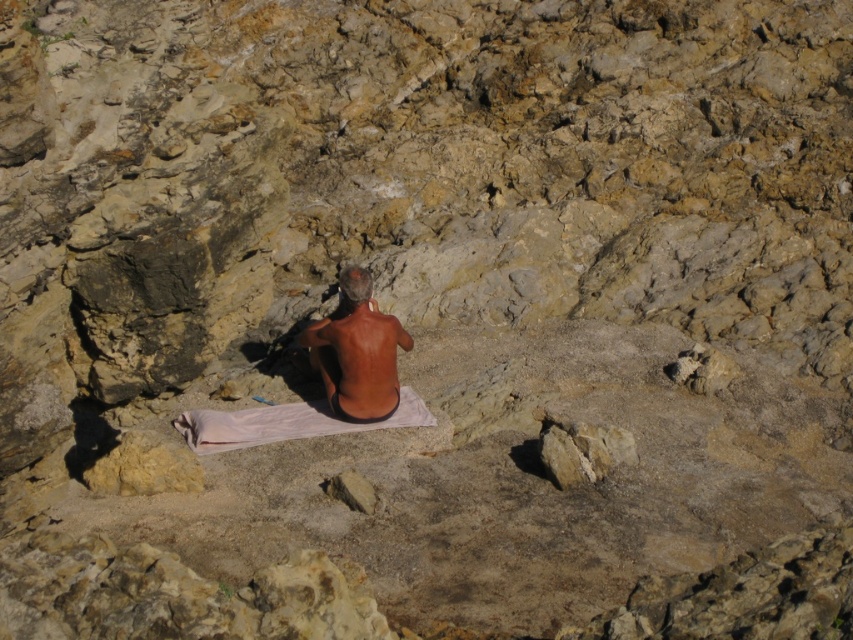
You are a photographer capturing the scene of a person in a rocky area. You notice the brown matte skin at center and the white cloth at center. Which object is narrower in width?

The brown matte skin at center is narrower in width compared to the white cloth at center.

You are standing at the center of the rocky terrain and want to move towards the two points marked in the image. Which point, point (338, 356) or point (280, 432), is closer to you?

Point (338, 356) is closer to you because it is further to the viewer than point (280, 432).

You are a photographer capturing the scene of a person in a rocky area. You notice the brown matte skin at center and the white cloth at center. Which one is positioned higher from the ground?

The brown matte skin at center is located above the white cloth at center, so it is positioned higher from the ground.